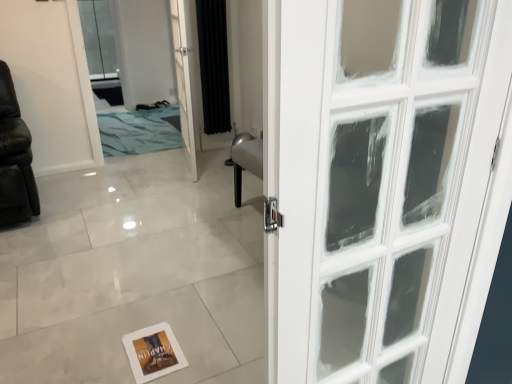
At what (x,y) coordinates should I click in order to perform the action: click on vacant space underneath white glass door at center (from a real-world perspective). Please return your answer as a coordinate pair (x, y). Looking at the image, I should click on (192, 170).